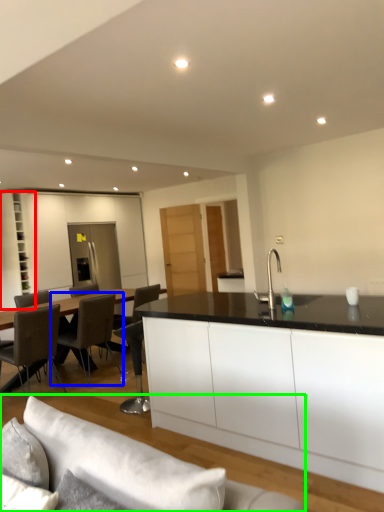
Question: Considering the real-world distances, which object is closest to cabinetry (highlighted by a red box)? chair (highlighted by a blue box) or studio couch (highlighted by a green box).

Choices:
 (A) chair
 (B) studio couch

Answer: (A)